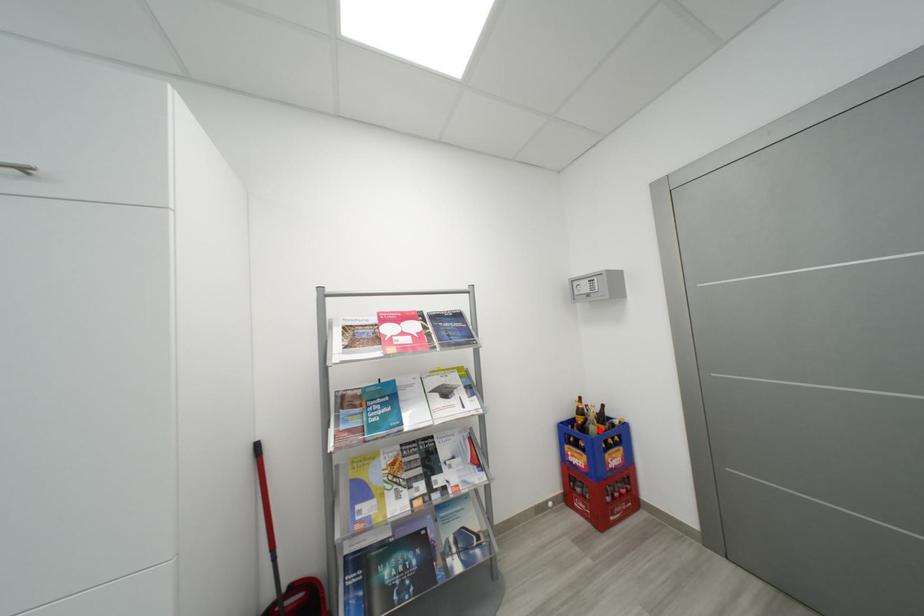
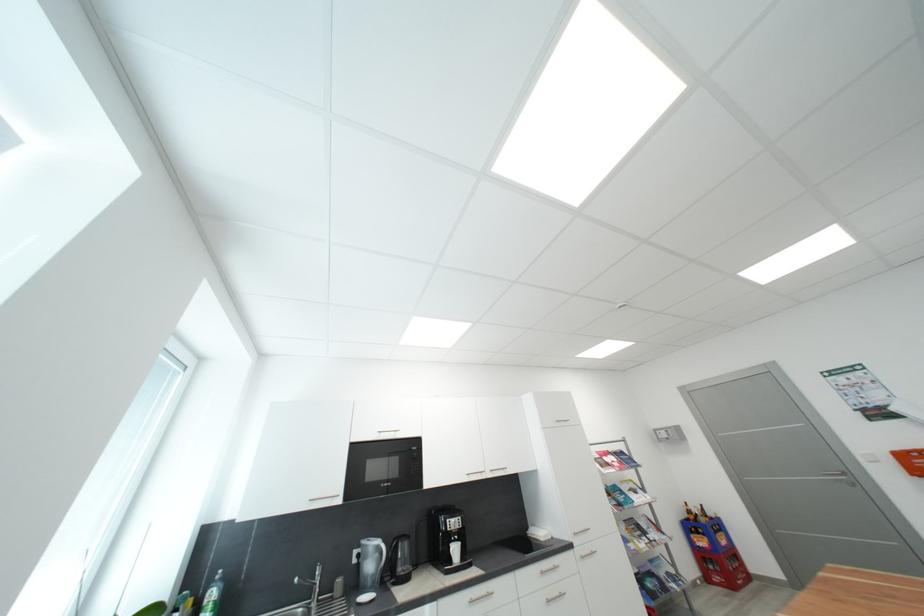
Question: I am providing you with two images of the same scene from different viewpoints. In image1, a red point is highlighted. Considering the same 3D point in image2, which of the following is correct?

Choices:
 (A) It is closer
 (B) It is farther

Answer: (A)